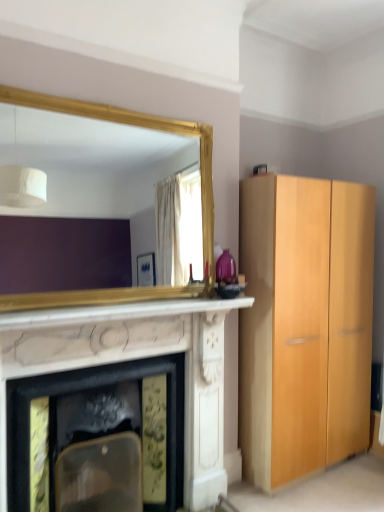
Question: Is white marble fireplace at center bigger than white marble fireplace at center?

Choices:
 (A) yes
 (B) no

Answer: (B)

Question: Are white marble fireplace at center and white marble fireplace at center making contact?

Choices:
 (A) no
 (B) yes

Answer: (A)

Question: Does white marble fireplace at center have a greater width compared to white marble fireplace at center?

Choices:
 (A) yes
 (B) no

Answer: (B)

Question: Could white marble fireplace at center be considered to be inside white marble fireplace at center?

Choices:
 (A) yes
 (B) no

Answer: (B)

Question: Is white marble fireplace at center further to camera compared to white marble fireplace at center?

Choices:
 (A) no
 (B) yes

Answer: (A)

Question: Considering the positions of white marble fireplace at center and white marble fireplace at center in the image, is white marble fireplace at center taller or shorter than white marble fireplace at center?

Choices:
 (A) short
 (B) tall

Answer: (A)

Question: Based on their positions, is white marble fireplace at center located to the left or right of white marble fireplace at center?

Choices:
 (A) left
 (B) right

Answer: (B)

Question: Is white marble fireplace at center spatially inside white marble fireplace at center, or outside of it?

Choices:
 (A) outside
 (B) inside

Answer: (A)

Question: From the image's perspective, is white marble fireplace at center located above or below white marble fireplace at center?

Choices:
 (A) below
 (B) above

Answer: (B)

Question: Considering the positions of gold-framed mirror at upper left and white marble fireplace at center in the image, is gold-framed mirror at upper left taller or shorter than white marble fireplace at center?

Choices:
 (A) short
 (B) tall

Answer: (A)

Question: Considering the positions of gold-framed mirror at upper left and white marble fireplace at center in the image, is gold-framed mirror at upper left wider or thinner than white marble fireplace at center?

Choices:
 (A) thin
 (B) wide

Answer: (A)

Question: From the image's perspective, relative to white marble fireplace at center, is gold-framed mirror at upper left above or below?

Choices:
 (A) above
 (B) below

Answer: (A)

Question: From a real-world perspective, is gold-framed mirror at upper left physically located above or below white marble fireplace at center?

Choices:
 (A) below
 (B) above

Answer: (B)

Question: Relative to white marble fireplace at center, is white marble fireplace at center in front or behind?

Choices:
 (A) behind
 (B) front

Answer: (A)

Question: Is white marble fireplace at center to the left or to the right of white marble fireplace at center in the image?

Choices:
 (A) left
 (B) right

Answer: (A)